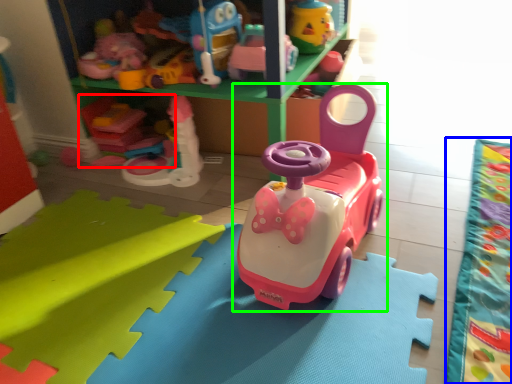
Question: Estimate the real-world distances between objects in this image. Which object is farther from toy (highlighted by a red box), blanket (highlighted by a blue box) or toy (highlighted by a green box)?

Choices:
 (A) blanket
 (B) toy

Answer: (A)